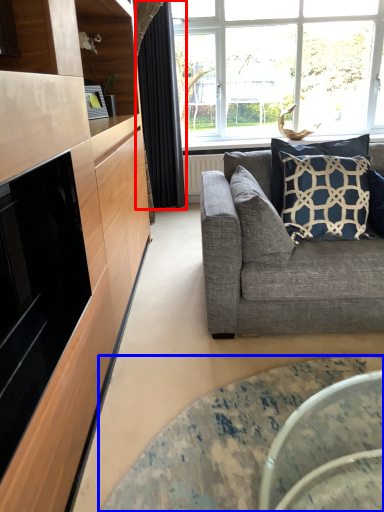
Question: Which object is further to the camera taking this photo, curtain (highlighted by a red box) or coffee table (highlighted by a blue box)?

Choices:
 (A) curtain
 (B) coffee table

Answer: (A)